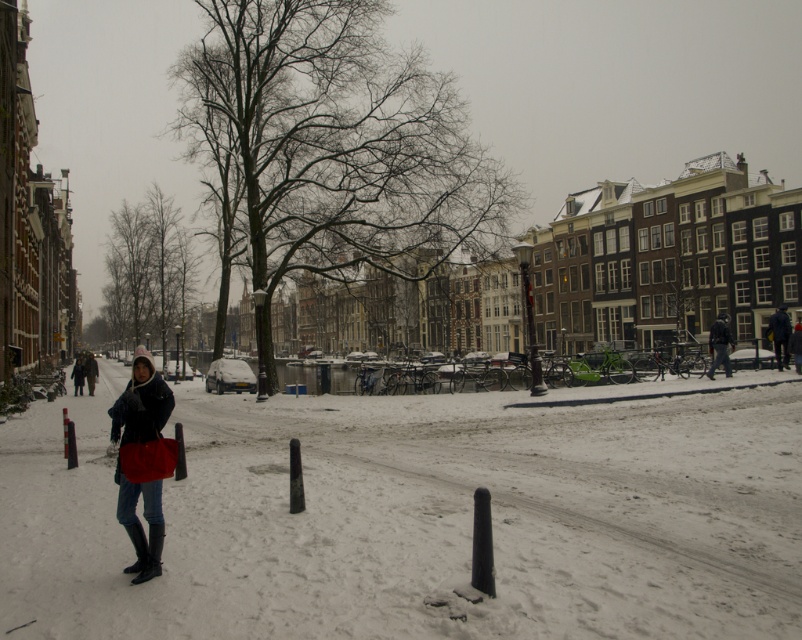
Question: Estimate the real-world distances between objects in this image. Which object is closer to the dark gray fabric jacket at right?

Choices:
 (A) matte black coat at center
 (B) white matte snow at center
 (C) dark blue jeans at right

Answer: (C)

Question: Considering the relative positions of white matte snow at center and dark gray fabric jacket at right in the image provided, where is white matte snow at center located with respect to dark gray fabric jacket at right?

Choices:
 (A) right
 (B) left

Answer: (B)

Question: Which object is closer to the camera taking this photo?

Choices:
 (A) matte black coat at center
 (B) dark blue jeans at right
 (C) dark blue jacket at center
 (D) white matte snow at center

Answer: (D)

Question: Is white matte snow at center positioned in front of dark blue jeans at right?

Choices:
 (A) yes
 (B) no

Answer: (A)

Question: Is dark gray fabric jacket at right positioned before dark blue jeans at right?

Choices:
 (A) no
 (B) yes

Answer: (B)

Question: Which point appears farthest from the camera in this image?

Choices:
 (A) (136, 362)
 (B) (796, 433)
 (C) (84, 369)

Answer: (C)